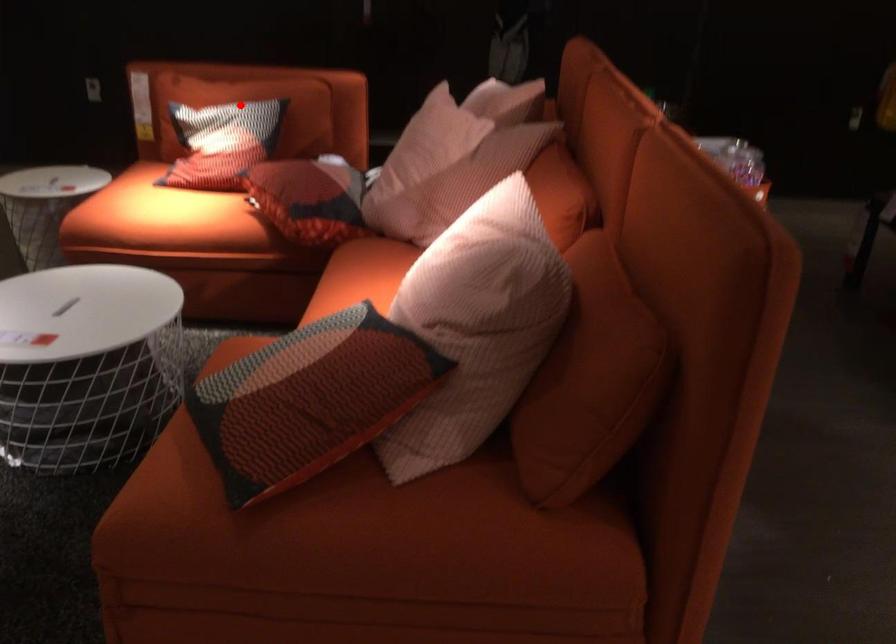
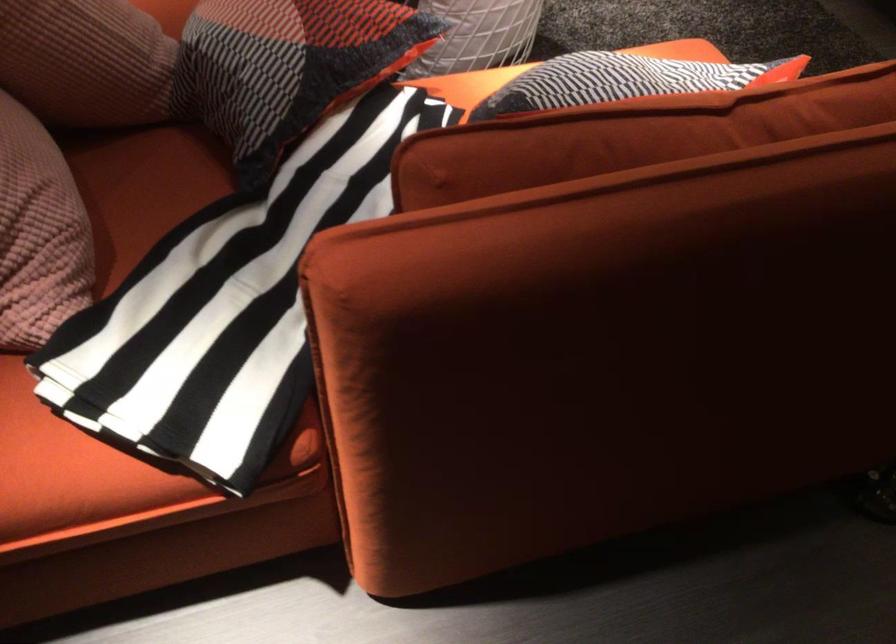
The point at the highlighted location is marked in the first image. Where is the corresponding point in the second image?

(623, 80)